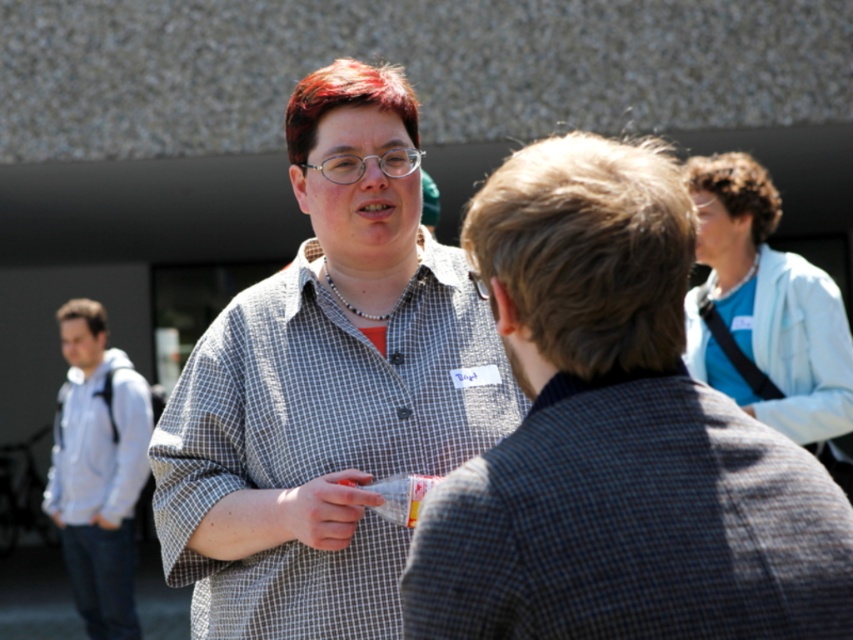
You are standing at the point marked by the coordinate point at point (659, 560). You want to approach the two people talking without being too close. What is the minimum distance you should maintain to stay at least 1 meter away from them?

The two individuals are 2.00 meters apart. To stay at least 1 meter away from both, you should position yourself at least 1 meter away from each, so the minimum distance from your current position would be the greater of the distances to each person plus 1 meter. However, without exact coordinates of both people, it is impossible to calculate precisely. Therefore, you should ensure you are at least 1 meter away from both individuals.

What object is located at the coordinate point (x=328, y=390) in the image?

The point (x=328, y=390) corresponds to the checkered shirt at center.

You are standing at the origin point in the image and want to locate the checkered shirt at center. In which direction should you look to find it?

The checkered shirt at center is located at point 0.611 on the x axis and 0.385 on the y axis, so you should look to the right and slightly downward from the center of the image.